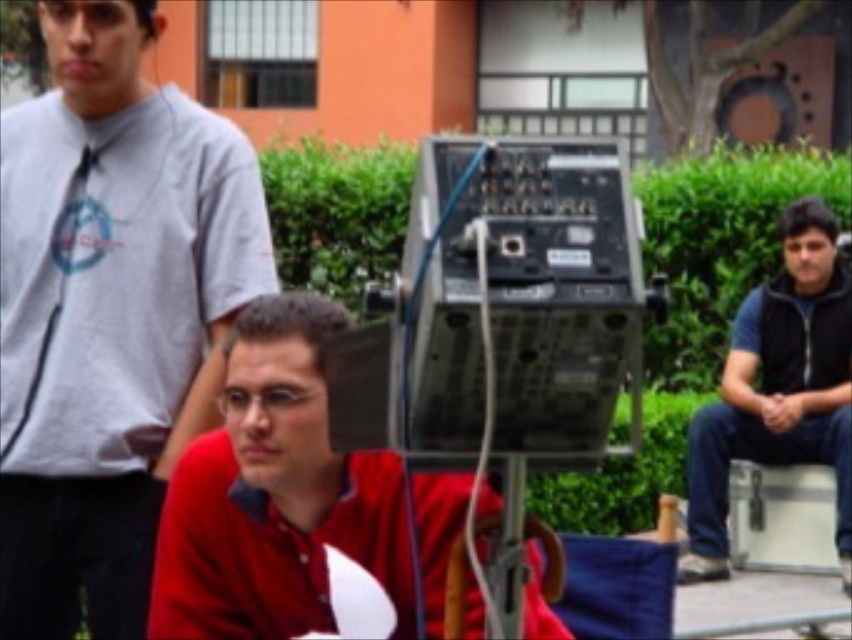
Looking at this image, you are organizing a photoshoot and need to arrange the matte gray shirt at left and the matte red shirt at center based on their widths. Which shirt should be placed on the narrower side of the setup?

The matte gray shirt at left has a lesser width compared to the matte red shirt at center, so it should be placed on the narrower side of the setup.

You are standing at the origin point in the image. Which direction should you move to reach the matte gray shirt at left?

The matte gray shirt at left is located at point 0.489 on the x and 0.129 on the y axis. Since the origin is at the bottom left corner, you should move to the right and slightly forward to reach it.